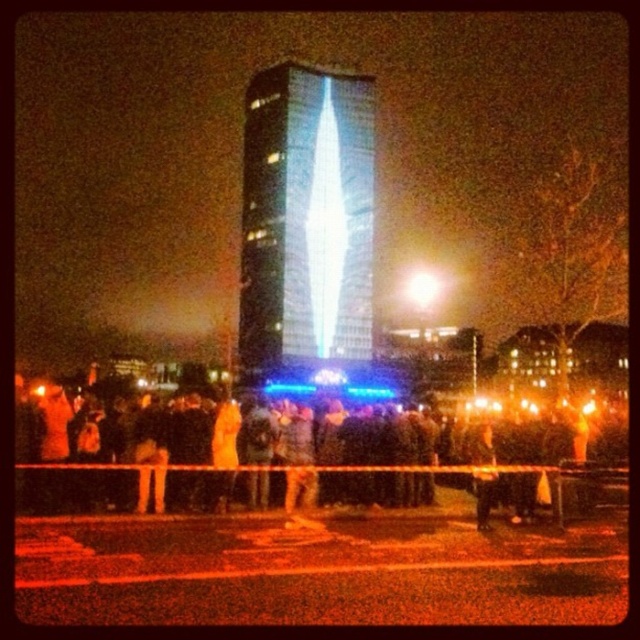
You are a photographer standing at the edge of the scene. You want to capture a photo of the transparent glass tower at center without the black fabric crowd at center appearing in the frame. Is this possible based on their positions?

The black fabric crowd at center is located below the transparent glass tower at center, so if you position yourself to aim your camera upward towards the tower, you can exclude the crowd from the frame by focusing on the upper part of the tower.

You are standing at the point marked as point (216, 506) in the image. A friend is located 82 meters away from you in the direction of the skyscraper. Can you see the skyscraper from your current position?

Yes, the skyscraper is visible from your current position at point (216, 506) because the distance between you and your friend is 82 meters, which suggests the line of sight is unobstructed.

You are standing in the nighttime urban scene looking at the skyscraper. There are two points marked in the image. Which point is closer to you, point (51, 484) or point (332, 237)?

Point (51, 484) is closer to the viewer than point (332, 237).